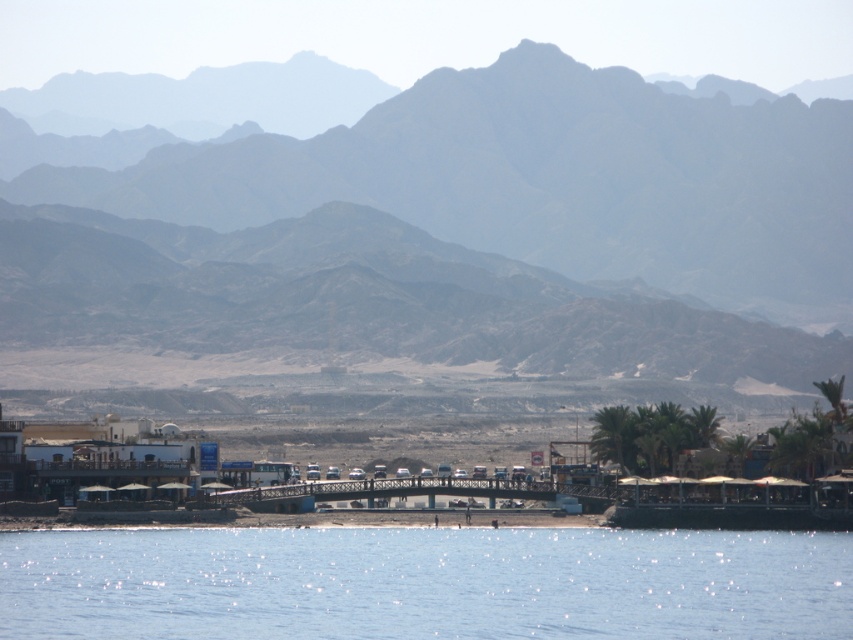
You are standing on the shore of the calm body of water and see the rocky gray mountains at upper center and the white plastic boat at lower right. Which object is positioned higher in the scene?

The rocky gray mountains at upper center are positioned higher in the scene than the white plastic boat at lower right.

You are standing at the point with coordinates point at (465, 234) in the coastal scene. What can you see in the direction you are facing?

You can see the rocky gray mountains at upper center in the direction you are facing.